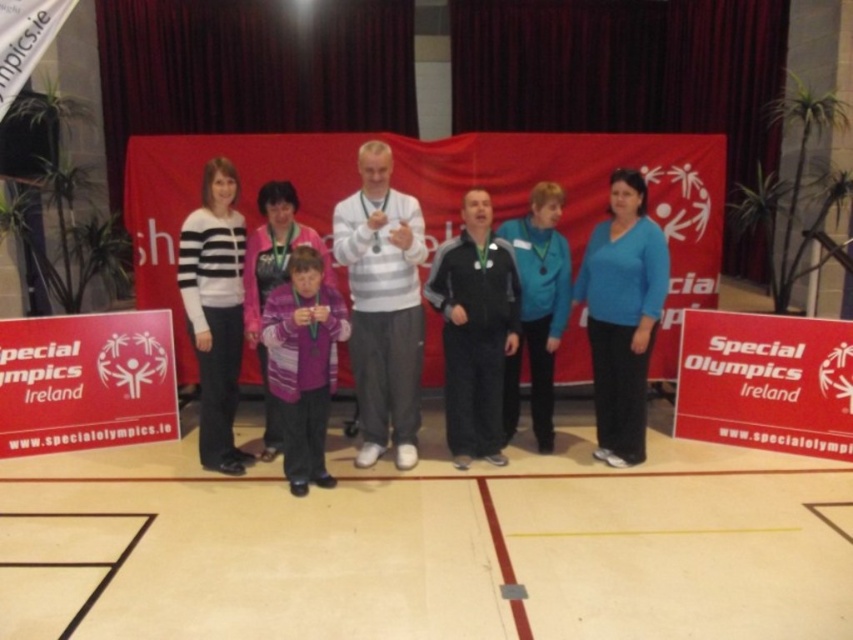
Question: Can you confirm if gray cotton sweater at center is thinner than blue matte sweater at center?

Choices:
 (A) no
 (B) yes

Answer: (A)

Question: Which object is closer to the camera taking this photo?

Choices:
 (A) blue matte sweater at center
 (B) white striped sweater at center
 (C) gray cotton sweater at center
 (D) black matte jacket at center

Answer: (C)

Question: Which of these objects is positioned farthest from the black matte jacket at center?

Choices:
 (A) blue matte sweater at center
 (B) purple knitwear at center
 (C) gray cotton sweater at center
 (D) white striped sweater at center

Answer: (D)

Question: Is the position of black matte jacket at center more distant than that of purple knitwear at center?

Choices:
 (A) no
 (B) yes

Answer: (B)

Question: Is blue matte sweater at center in front of black matte jacket at center?

Choices:
 (A) yes
 (B) no

Answer: (A)

Question: Which point is closer to the camera?

Choices:
 (A) black matte jacket at center
 (B) white striped sweater at center

Answer: (B)